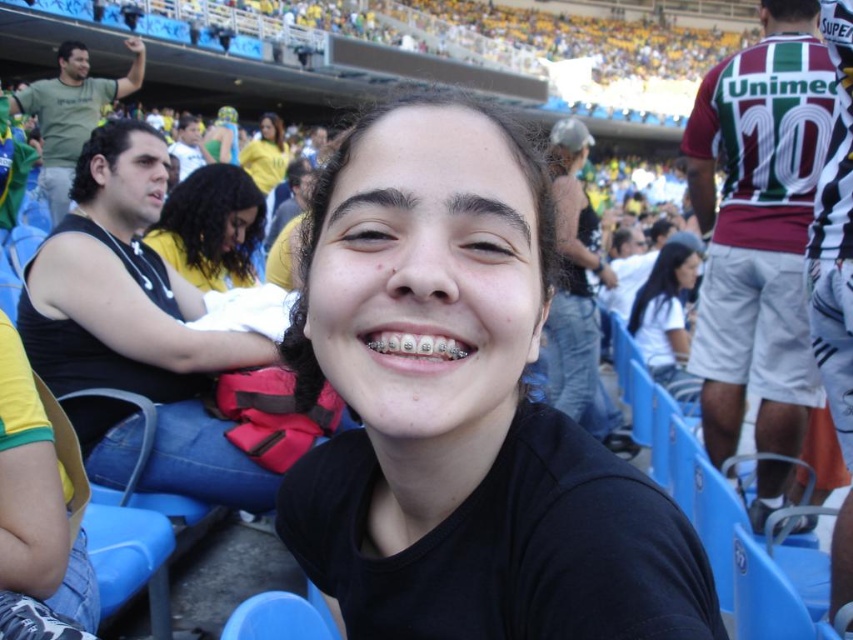
Question: Can you confirm if black matte hair at center is positioned to the left of dark brown hair at center?

Choices:
 (A) yes
 (B) no

Answer: (B)

Question: Which of the following is the closest to the observer?

Choices:
 (A) dark brown hair at center
 (B) black matte shirt at center

Answer: (B)

Question: Is black matte hair at center positioned at the back of white matte shirt at center?

Choices:
 (A) no
 (B) yes

Answer: (A)

Question: Which of the following is the farthest from the observer?

Choices:
 (A) (567, 202)
 (B) (247, 164)
 (C) (670, 355)
 (D) (682, 628)

Answer: (B)

Question: Does black matte shirt at center have a smaller size compared to yellow jersey at upper center?

Choices:
 (A) yes
 (B) no

Answer: (B)

Question: Which object is positioned closest to the white matte shirt at center?

Choices:
 (A) yellow jersey at upper center
 (B) dark brown hair at center

Answer: (B)